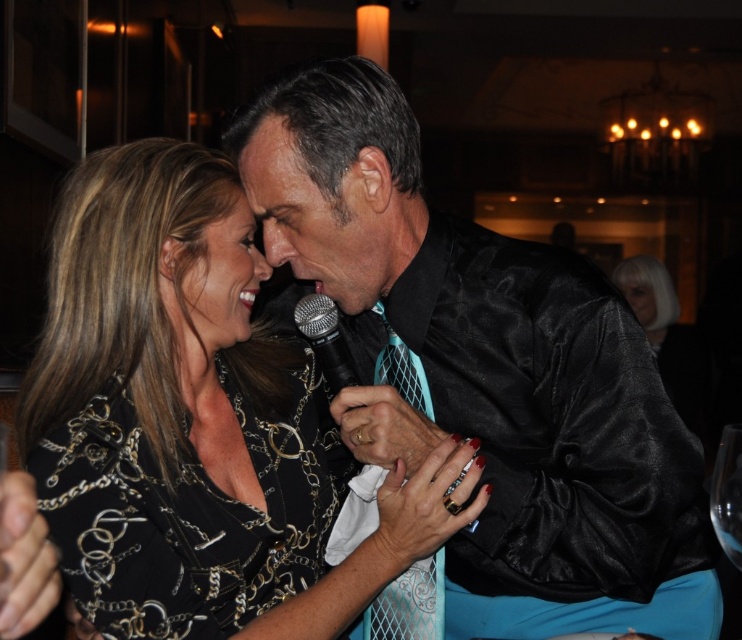
What object is located at the coordinates point (487, 372)?

The black satin shirt at center is located at point (487, 372).